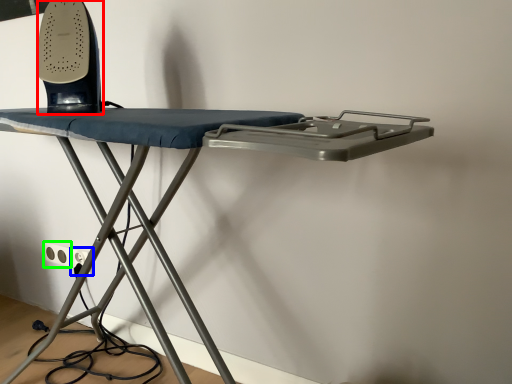
Question: Estimate the real-world distances between objects in this image. Which object is farther from equipment (highlighted by a red box), electric outlet (highlighted by a blue box) or electric outlet (highlighted by a green box)?

Choices:
 (A) electric outlet
 (B) electric outlet

Answer: (B)